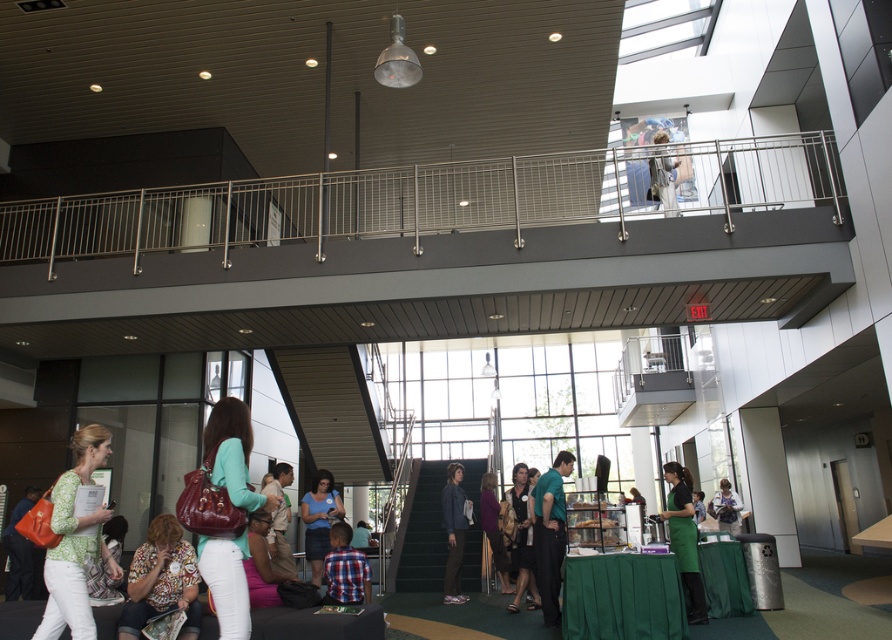
Question: Among these points, which one is farthest from the camera?

Choices:
 (A) (178, 572)
 (B) (667, 156)

Answer: (B)

Question: Can you confirm if green matte shirt at center is smaller than green fabric apron at lower center?

Choices:
 (A) yes
 (B) no

Answer: (A)

Question: Can you confirm if matte blue shirt at center is bigger than green fabric shirt at center?

Choices:
 (A) yes
 (B) no

Answer: (B)

Question: Among these points, which one is nearest to the camera?

Choices:
 (A) (568, 456)
 (B) (489, 545)
 (C) (686, 532)
 (D) (318, 566)

Answer: (A)

Question: Which point is closer to the camera?

Choices:
 (A) (721, 509)
 (B) (6, 552)
 (C) (248, 570)
 (D) (524, 504)

Answer: (C)

Question: Is matte black dress at center behind pink fabric at lower center?

Choices:
 (A) no
 (B) yes

Answer: (B)